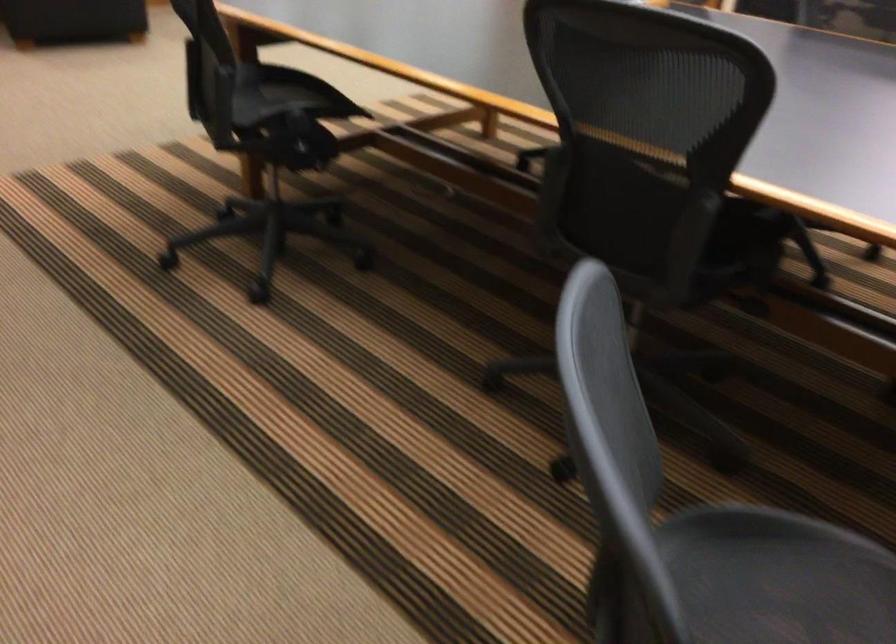
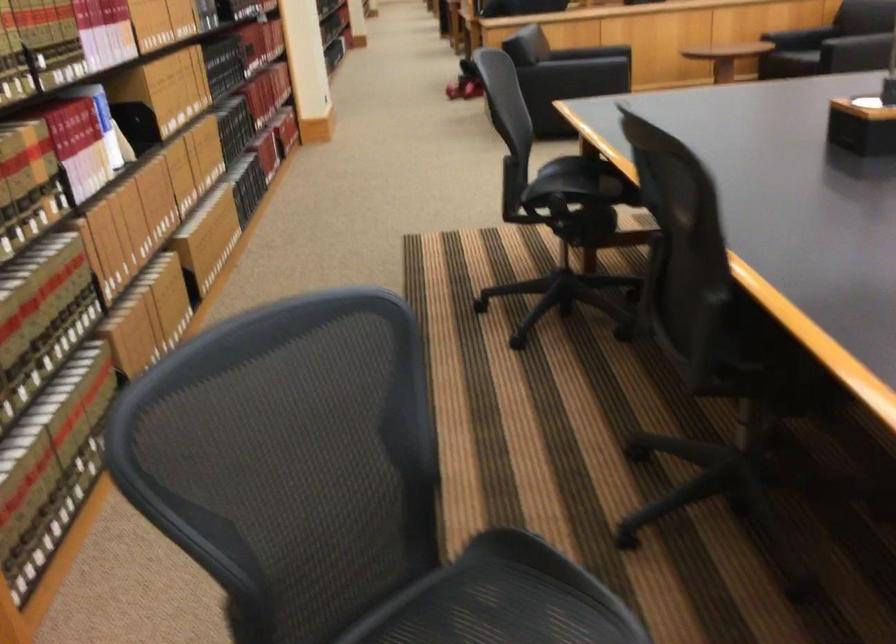
Where in the second image is the point corresponding to (290,97) from the first image?

(574, 182)